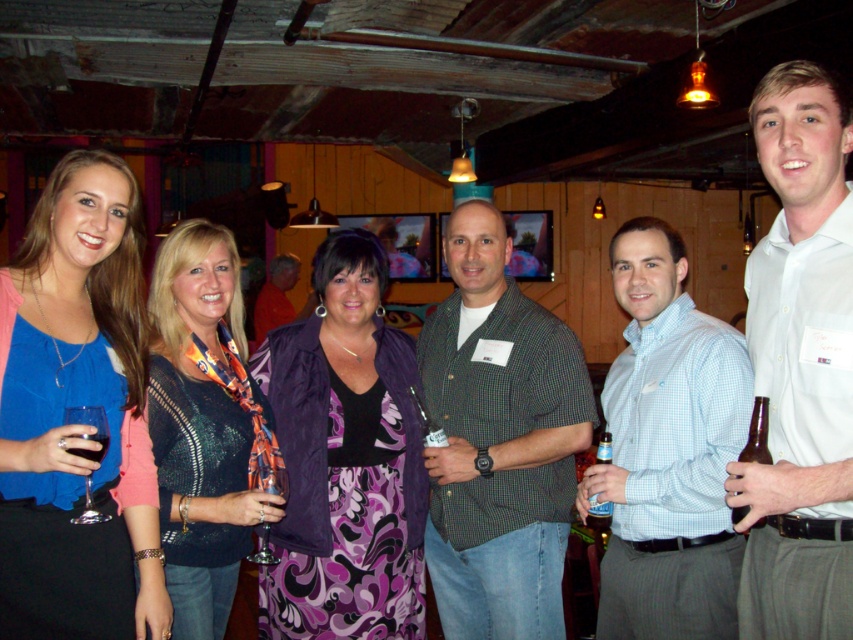
Which is below, matte blue blouse at center or light blue checkered shirt at center?

light blue checkered shirt at center is lower down.

Can you confirm if matte blue blouse at center is smaller than light blue checkered shirt at center?

Indeed, matte blue blouse at center has a smaller size compared to light blue checkered shirt at center.

Between point (86, 346) and point (695, 451), which one is positioned in front?

Point (86, 346) is more forward.

I want to click on matte blue blouse at center, so click(64, 404).

Between orange shirt at center and clear glass wine glass at center, which one has more height?

A: Standing taller between the two is orange shirt at center.

Does point (281, 304) come in front of point (251, 552)?

No, it is behind (251, 552).

Identify the location of orange shirt at center. The width and height of the screenshot is (853, 640). (276, 296).

Is light blue checkered shirt at center bigger than transparent glass at lower left?

Yes, light blue checkered shirt at center is bigger than transparent glass at lower left.

Who is more forward, (643, 365) or (96, 426)?

Point (96, 426) is in front.

Locate an element on the screen. This screenshot has width=853, height=640. light blue checkered shirt at center is located at coordinates (668, 451).